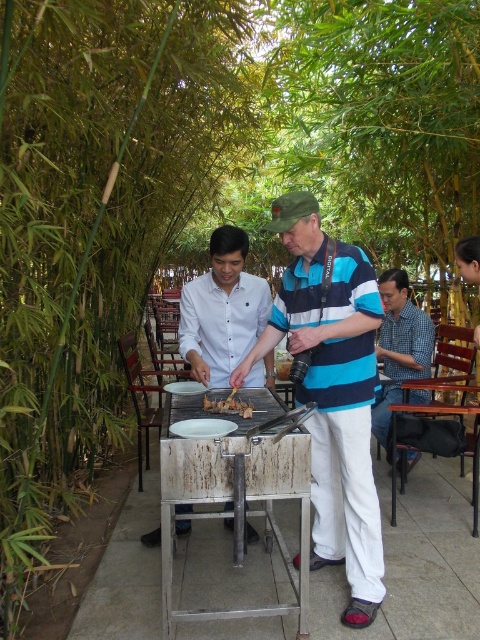
You are a photographer trying to capture a candid shot of the two people cooking. You want to ensure both the striped cotton shirt at center and the white matte shirt at center are visible in the frame. Based on their positions, which shirt should you focus on first to include both in the shot?

The striped cotton shirt at center is positioned on the right side of white matte shirt at center, so you should focus on the white matte shirt at center first to ensure both are in the frame.

You are a fashion designer observing two people at a barbecue. You notice the striped cotton shirt at center and the white matte shirt at center. Which shirt would you recommend for a client who prefers a more voluminous style?

The striped cotton shirt at center has a larger size compared to white matte shirt at center, so it would be the better choice for someone preferring a more voluminous style.

You are a photographer trying to capture a clear photo of both the white matte shirt at center and the blue checkered shirt at right. Since you want both subjects to be in focus, which one should you focus on first to ensure the other is also in focus?

You should focus on the white matte shirt at center first because it is closer to the camera than the blue checkered shirt at right. By focusing on the closer subject, the farther one will also be in focus due to the depth of field.